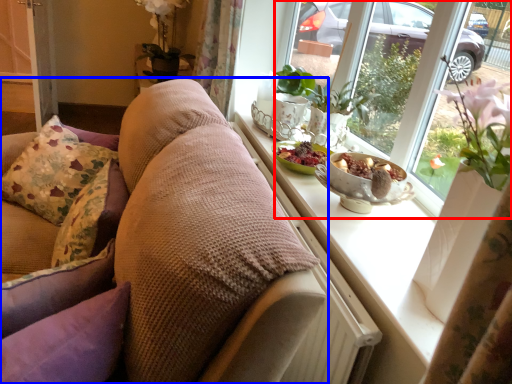
Question: Among these objects, which one is nearest to the camera, window (highlighted by a red box) or studio couch (highlighted by a blue box)?

Choices:
 (A) window
 (B) studio couch

Answer: (B)